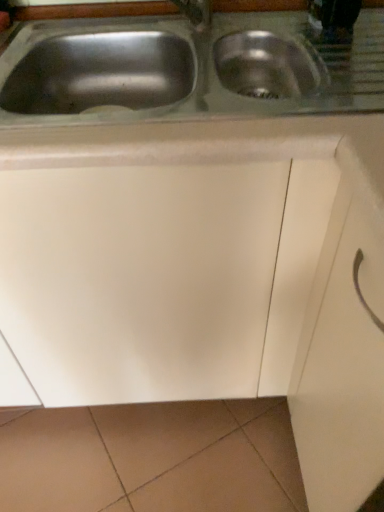
Question: Should I look upward or downward to see stainless steel sink at center?

Choices:
 (A) up
 (B) down

Answer: (A)

Question: From the image's perspective, is stainless steel sink at center below white matte drawer at center?

Choices:
 (A) yes
 (B) no

Answer: (B)

Question: Can you confirm if stainless steel sink at center is thinner than white matte drawer at center?

Choices:
 (A) no
 (B) yes

Answer: (A)

Question: Is stainless steel sink at center at the right side of white matte drawer at center?

Choices:
 (A) yes
 (B) no

Answer: (B)

Question: Would you say stainless steel sink at center is a long distance from white matte drawer at center?

Choices:
 (A) yes
 (B) no

Answer: (B)

Question: From the image's perspective, would you say stainless steel sink at center is positioned over white matte drawer at center?

Choices:
 (A) no
 (B) yes

Answer: (B)

Question: Would you say stainless steel sink at center is outside white matte drawer at center?

Choices:
 (A) no
 (B) yes

Answer: (B)

Question: Can you confirm if white matte drawer at center is shorter than stainless steel sink at center?

Choices:
 (A) yes
 (B) no

Answer: (B)

Question: Would you say white matte drawer at center contains stainless steel sink at center?

Choices:
 (A) yes
 (B) no

Answer: (B)

Question: Can you confirm if white matte drawer at center is positioned to the left of stainless steel sink at center?

Choices:
 (A) no
 (B) yes

Answer: (A)

Question: Is white matte drawer at center positioned with its back to stainless steel sink at center?

Choices:
 (A) no
 (B) yes

Answer: (A)

Question: Is white matte drawer at center far from stainless steel sink at center?

Choices:
 (A) yes
 (B) no

Answer: (B)

Question: Is white matte drawer at center with stainless steel sink at center?

Choices:
 (A) no
 (B) yes

Answer: (A)

Question: From a real-world perspective, is white matte drawer at center physically located above or below stainless steel sink at center?

Choices:
 (A) above
 (B) below

Answer: (B)